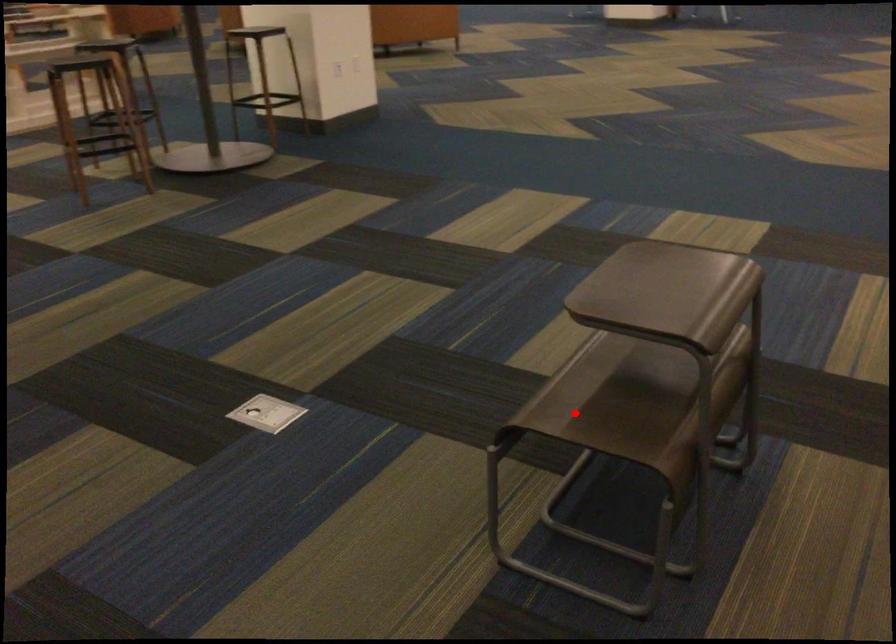
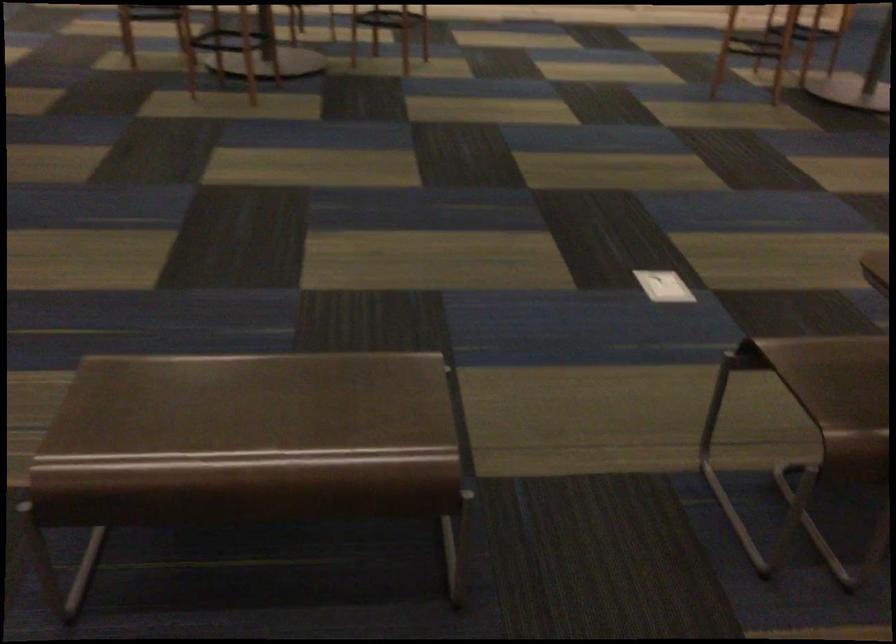
Where in the second image is the point corresponding to the highlighted location from the first image?

(823, 366)